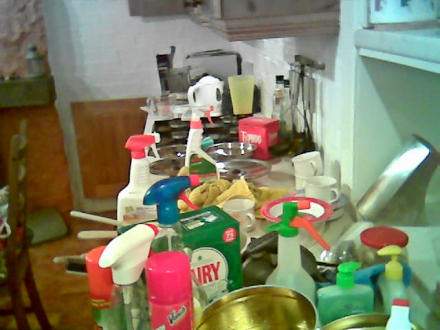
Identify the location of chair'. (17, 252).